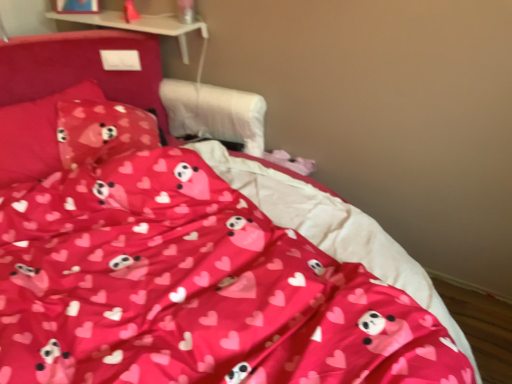
Identify the location of pink fabric pillow at upper left, which appears as the first pillow when viewed from the left. This screenshot has width=512, height=384. (36, 135).

The height and width of the screenshot is (384, 512). Describe the element at coordinates (36, 135) in the screenshot. I see `pink fabric pillow at upper left, which appears as the first pillow when viewed from the left` at that location.

This screenshot has width=512, height=384. What do you see at coordinates (102, 131) in the screenshot? I see `matte pink fabric pillow at upper left, marked as the second pillow in a left-to-right arrangement` at bounding box center [102, 131].

This screenshot has width=512, height=384. I want to click on matte pink fabric pillow at upper left, marked as the second pillow in a left-to-right arrangement, so click(x=102, y=131).

Locate an element on the screen. Image resolution: width=512 pixels, height=384 pixels. pink fabric pillow at upper left, which is the second pillow in right-to-left order is located at coordinates (36, 135).

Is matte pink fabric pillow at upper left, which is the first pillow from right to left, to the left of pink fabric pillow at upper left, which appears as the first pillow when viewed from the left, from the viewer's perspective?

In fact, matte pink fabric pillow at upper left, which is the first pillow from right to left, is to the right of pink fabric pillow at upper left, which appears as the first pillow when viewed from the left.

Is matte pink fabric pillow at upper left, marked as the second pillow in a left-to-right arrangement, closer to camera compared to pink fabric pillow at upper left, which is the second pillow in right-to-left order?

No, matte pink fabric pillow at upper left, marked as the second pillow in a left-to-right arrangement, is further to the viewer.

Considering the positions of points (138, 121) and (3, 128), is point (138, 121) farther from camera compared to point (3, 128)?

Yes, it is.

From the image's perspective, does matte pink fabric pillow at upper left, which is the first pillow from right to left, appear higher than pink fabric pillow at upper left, which appears as the first pillow when viewed from the left?

Incorrect, from the image's perspective, matte pink fabric pillow at upper left, which is the first pillow from right to left, is lower than pink fabric pillow at upper left, which appears as the first pillow when viewed from the left.

From a real-world perspective, which is physically below, matte pink fabric pillow at upper left, which is the first pillow from right to left, or pink fabric pillow at upper left, which is the second pillow in right-to-left order?

From a 3D spatial view, matte pink fabric pillow at upper left, which is the first pillow from right to left, is below.

Which of these two, matte pink fabric pillow at upper left, which is the first pillow from right to left, or pink fabric pillow at upper left, which is the second pillow in right-to-left order, is thinner?

With smaller width is matte pink fabric pillow at upper left, which is the first pillow from right to left.

Does matte pink fabric pillow at upper left, marked as the second pillow in a left-to-right arrangement, have a lesser height compared to pink fabric pillow at upper left, which appears as the first pillow when viewed from the left?

Yes.

Is matte pink fabric pillow at upper left, marked as the second pillow in a left-to-right arrangement, bigger than pink fabric pillow at upper left, which is the second pillow in right-to-left order?

Incorrect, matte pink fabric pillow at upper left, marked as the second pillow in a left-to-right arrangement, is not larger than pink fabric pillow at upper left, which is the second pillow in right-to-left order.

Is pink fabric pillow at upper left, which is the second pillow in right-to-left order, surrounded by matte pink fabric pillow at upper left, marked as the second pillow in a left-to-right arrangement?

No, matte pink fabric pillow at upper left, marked as the second pillow in a left-to-right arrangement, does not contain pink fabric pillow at upper left, which is the second pillow in right-to-left order.

Based on the photo, are matte pink fabric pillow at upper left, marked as the second pillow in a left-to-right arrangement, and pink fabric pillow at upper left, which appears as the first pillow when viewed from the left, far apart?

Actually, matte pink fabric pillow at upper left, marked as the second pillow in a left-to-right arrangement, and pink fabric pillow at upper left, which appears as the first pillow when viewed from the left, are a little close together.

Could you tell me if matte pink fabric pillow at upper left, which is the first pillow from right to left, is facing pink fabric pillow at upper left, which appears as the first pillow when viewed from the left?

Yes, matte pink fabric pillow at upper left, which is the first pillow from right to left, faces towards pink fabric pillow at upper left, which appears as the first pillow when viewed from the left.

How different are the orientations of matte pink fabric pillow at upper left, which is the first pillow from right to left, and pink fabric pillow at upper left, which is the second pillow in right-to-left order, in degrees?

The angle between the facing direction of matte pink fabric pillow at upper left, which is the first pillow from right to left, and the facing direction of pink fabric pillow at upper left, which is the second pillow in right-to-left order, is 25.1 degrees.

Image resolution: width=512 pixels, height=384 pixels. I want to click on pillow that appears behind the pink fabric pillow at upper left, which appears as the first pillow when viewed from the left, so click(x=102, y=131).

Can you confirm if pink fabric pillow at upper left, which is the second pillow in right-to-left order, is positioned to the right of matte pink fabric pillow at upper left, which is the first pillow from right to left?

Incorrect, pink fabric pillow at upper left, which is the second pillow in right-to-left order, is not on the right side of matte pink fabric pillow at upper left, which is the first pillow from right to left.

Is pink fabric pillow at upper left, which is the second pillow in right-to-left order, positioned in front of matte pink fabric pillow at upper left, which is the first pillow from right to left?

Yes, pink fabric pillow at upper left, which is the second pillow in right-to-left order, is in front of matte pink fabric pillow at upper left, which is the first pillow from right to left.

Considering the positions of points (17, 168) and (85, 144), is point (17, 168) closer to camera compared to point (85, 144)?

Yes.

From the image's perspective, which one is positioned lower, pink fabric pillow at upper left, which appears as the first pillow when viewed from the left, or matte pink fabric pillow at upper left, which is the first pillow from right to left?

matte pink fabric pillow at upper left, which is the first pillow from right to left, from the image's perspective.

From a real-world perspective, which object rests below the other?

matte pink fabric pillow at upper left, marked as the second pillow in a left-to-right arrangement.

Considering the sizes of objects pink fabric pillow at upper left, which is the second pillow in right-to-left order, and matte pink fabric pillow at upper left, marked as the second pillow in a left-to-right arrangement, in the image provided, who is wider, pink fabric pillow at upper left, which is the second pillow in right-to-left order, or matte pink fabric pillow at upper left, marked as the second pillow in a left-to-right arrangement,?

pink fabric pillow at upper left, which is the second pillow in right-to-left order, is wider.

Considering the sizes of pink fabric pillow at upper left, which is the second pillow in right-to-left order, and matte pink fabric pillow at upper left, which is the first pillow from right to left, in the image, is pink fabric pillow at upper left, which is the second pillow in right-to-left order, taller or shorter than matte pink fabric pillow at upper left, which is the first pillow from right to left,?

In the image, pink fabric pillow at upper left, which is the second pillow in right-to-left order, appears to be taller than matte pink fabric pillow at upper left, which is the first pillow from right to left.

Considering the sizes of pink fabric pillow at upper left, which appears as the first pillow when viewed from the left, and matte pink fabric pillow at upper left, which is the first pillow from right to left, in the image, is pink fabric pillow at upper left, which appears as the first pillow when viewed from the left, bigger or smaller than matte pink fabric pillow at upper left, which is the first pillow from right to left,?

Clearly, pink fabric pillow at upper left, which appears as the first pillow when viewed from the left, is larger in size than matte pink fabric pillow at upper left, which is the first pillow from right to left.

Is pink fabric pillow at upper left, which appears as the first pillow when viewed from the left, surrounding matte pink fabric pillow at upper left, marked as the second pillow in a left-to-right arrangement?

Yes, matte pink fabric pillow at upper left, marked as the second pillow in a left-to-right arrangement, is a part of pink fabric pillow at upper left, which appears as the first pillow when viewed from the left.

Is pink fabric pillow at upper left, which appears as the first pillow when viewed from the left, in contact with matte pink fabric pillow at upper left, which is the first pillow from right to left?

No, pink fabric pillow at upper left, which appears as the first pillow when viewed from the left, is not making contact with matte pink fabric pillow at upper left, which is the first pillow from right to left.

Is pink fabric pillow at upper left, which appears as the first pillow when viewed from the left, aimed at matte pink fabric pillow at upper left, which is the first pillow from right to left?

Yes, pink fabric pillow at upper left, which appears as the first pillow when viewed from the left, is oriented towards matte pink fabric pillow at upper left, which is the first pillow from right to left.

What's the angular difference between pink fabric pillow at upper left, which appears as the first pillow when viewed from the left, and matte pink fabric pillow at upper left, marked as the second pillow in a left-to-right arrangement,'s facing directions?

pink fabric pillow at upper left, which appears as the first pillow when viewed from the left, and matte pink fabric pillow at upper left, marked as the second pillow in a left-to-right arrangement, are facing 25.1 degrees away from each other.

Measure the distance from pink fabric pillow at upper left, which appears as the first pillow when viewed from the left, to matte pink fabric pillow at upper left, marked as the second pillow in a left-to-right arrangement.

The distance of pink fabric pillow at upper left, which appears as the first pillow when viewed from the left, from matte pink fabric pillow at upper left, marked as the second pillow in a left-to-right arrangement, is 4.95 inches.

Where is `pillow located above the matte pink fabric pillow at upper left, marked as the second pillow in a left-to-right arrangement (from the image's perspective)`? pillow located above the matte pink fabric pillow at upper left, marked as the second pillow in a left-to-right arrangement (from the image's perspective) is located at coordinates (36, 135).

I want to click on pillow above the matte pink fabric pillow at upper left, marked as the second pillow in a left-to-right arrangement (from a real-world perspective), so click(x=36, y=135).

Image resolution: width=512 pixels, height=384 pixels. Identify the location of pillow that appears below the pink fabric pillow at upper left, which appears as the first pillow when viewed from the left (from a real-world perspective). (102, 131).